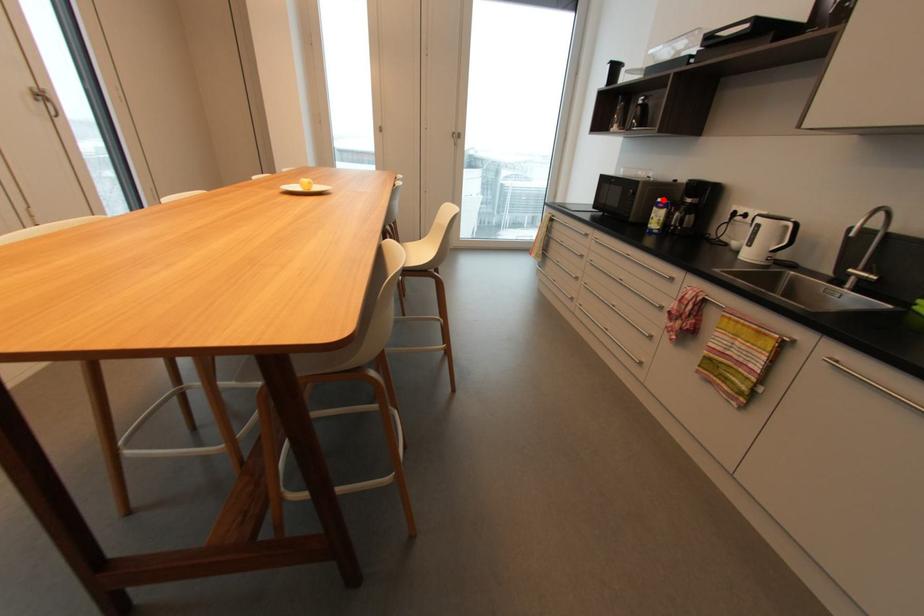
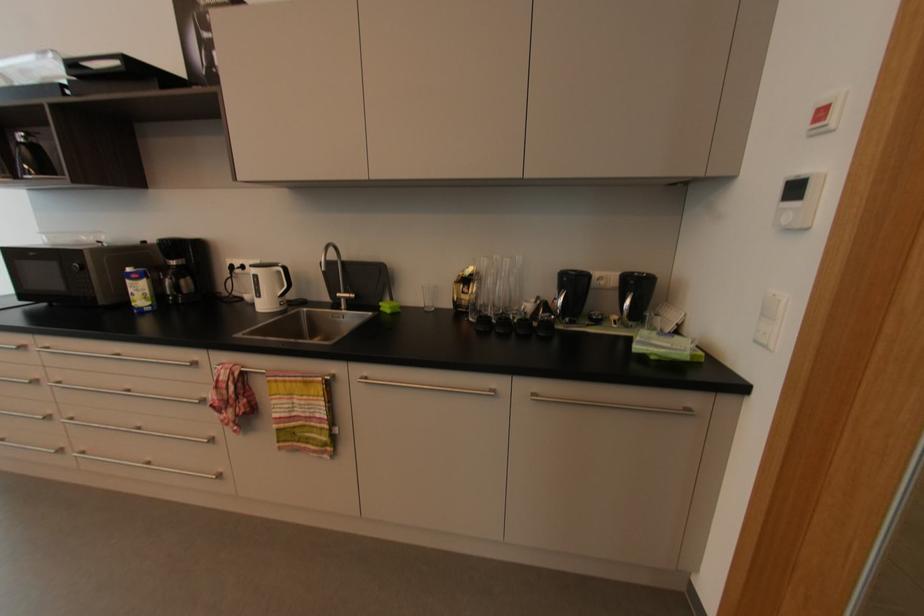
Question: I am providing you with two images of the same scene from different viewpoints. In image1, a red point is highlighted. Considering the same 3D point in image2, which of the following is correct?

Choices:
 (A) It is closer
 (B) It is farther

Answer: (B)